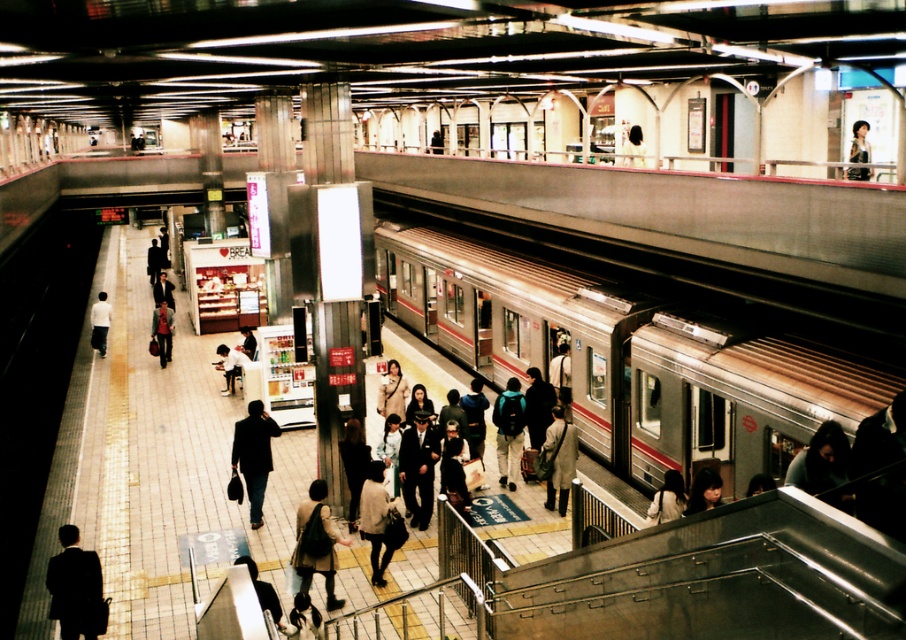
You are a passenger waiting at the subway station platform. You notice a white fabric bag at center and a light brown leather jacket at center near you. Which item takes up more space?

The light brown leather jacket at center takes up more space than the white fabric bag at center.

You are a passenger waiting on the platform and notice the silver metallic train at center and the person with smooth black hair at lower right. Which object is taller?

The silver metallic train at center is taller than the smooth black hair at lower right.

You are a fashion designer observing the subway station scene. You notice two items of clothing at the center of the platform. Which item is taller between the matte beige dress at center and the matte beige coat at center?

The matte beige dress at center is taller than the matte beige coat at center according to the description.